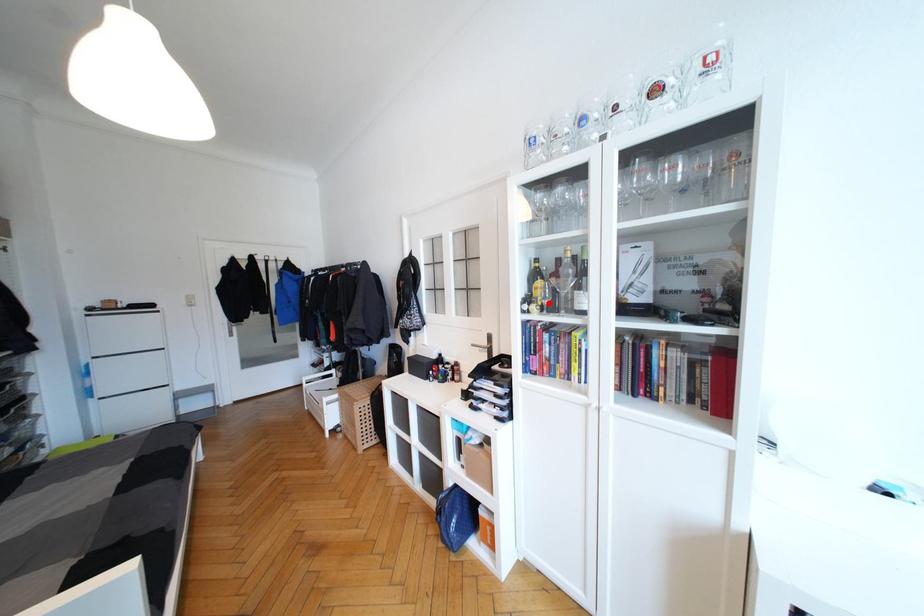
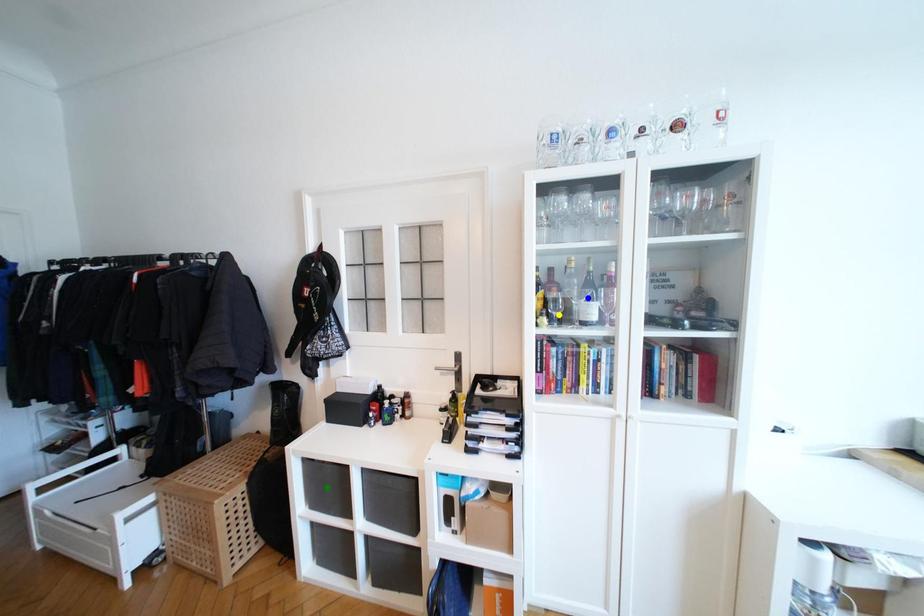
Question: I am providing you with two images of the same scene from different viewpoints. A red point is marked on the first image. You are given multiple points on the second image. Which mark in image 2 goes with the point in image 1?

Choices:
 (A) yellow point
 (B) blue point
 (C) green point

Answer: (A)